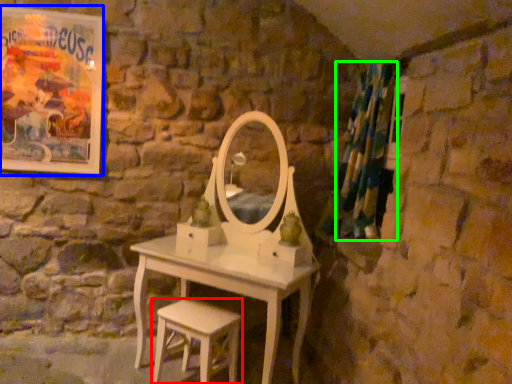
Question: Based on their relative distances, which object is nearer to stool (highlighted by a red box)? Choose from poster page (highlighted by a blue box) and shower curtain (highlighted by a green box).

Choices:
 (A) poster page
 (B) shower curtain

Answer: (B)